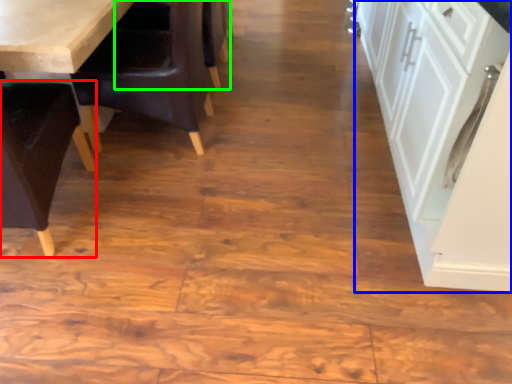
Question: Considering the real-world distances, which object is closest to chair (highlighted by a red box)? cabinetry (highlighted by a blue box) or armchair (highlighted by a green box).

Choices:
 (A) cabinetry
 (B) armchair

Answer: (B)